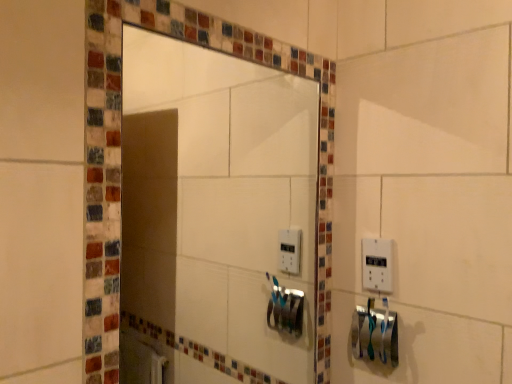
The height and width of the screenshot is (384, 512). In order to click on white plastic light switch at right in this screenshot , I will do `click(377, 265)`.

What do you see at coordinates (377, 265) in the screenshot? The image size is (512, 384). I see `white plastic light switch at right` at bounding box center [377, 265].

The height and width of the screenshot is (384, 512). What do you see at coordinates (218, 205) in the screenshot? I see `matte glass mirror at center` at bounding box center [218, 205].

This screenshot has width=512, height=384. Identify the location of white plastic light switch at right. (377, 265).

Could you measure the distance between silver metallic towel bar at lower right and white plastic light switch at right?

silver metallic towel bar at lower right and white plastic light switch at right are 4.27 inches apart.

Would you say silver metallic towel bar at lower right is outside white plastic light switch at right?

That's correct, silver metallic towel bar at lower right is outside of white plastic light switch at right.

Which of these two, silver metallic towel bar at lower right or white plastic light switch at right, is bigger?

silver metallic towel bar at lower right is bigger.

Is there a large distance between silver metallic towel bar at lower right and white plastic light switch at right?

No.

Which point is more distant from viewer, (353, 317) or (132, 148)?

Point (132, 148)

Based on the photo, which of these two, silver metallic towel bar at lower right or matte glass mirror at center, stands shorter?

Standing shorter between the two is silver metallic towel bar at lower right.

From the image's perspective, is silver metallic towel bar at lower right beneath matte glass mirror at center?

Correct, silver metallic towel bar at lower right appears lower than matte glass mirror at center in the image.

In terms of width, does silver metallic towel bar at lower right look wider or thinner when compared to matte glass mirror at center?

silver metallic towel bar at lower right is wider than matte glass mirror at center.

Is matte glass mirror at center looking in the opposite direction of silver metallic towel bar at lower right?

No.

Who is taller, matte glass mirror at center or silver metallic towel bar at lower right?

With more height is matte glass mirror at center.

Would you say matte glass mirror at center is inside or outside silver metallic towel bar at lower right?

matte glass mirror at center exists outside the volume of silver metallic towel bar at lower right.

Looking at this image, which is closer, [174,53] or [381,346]?

The point [381,346] is closer.

From a real-world perspective, who is located higher, white plastic light switch at right or silver metallic towel bar at lower right?

white plastic light switch at right is physically above.

Is white plastic light switch at right in front of or behind silver metallic towel bar at lower right in the image?

white plastic light switch at right is behind silver metallic towel bar at lower right.

Measure the distance between white plastic light switch at right and silver metallic towel bar at lower right.

The distance of white plastic light switch at right from silver metallic towel bar at lower right is 4.27 inches.

Is white plastic light switch at right situated inside silver metallic towel bar at lower right or outside?

white plastic light switch at right exists outside the volume of silver metallic towel bar at lower right.

Which is behind, point (175, 119) or point (385, 279)?

The point (175, 119) is more distant.

Which is more to the right, matte glass mirror at center or white plastic light switch at right?

From the viewer's perspective, white plastic light switch at right appears more on the right side.

Can you confirm if matte glass mirror at center is smaller than white plastic light switch at right?

No, matte glass mirror at center is not smaller than white plastic light switch at right.

Is matte glass mirror at center not near white plastic light switch at right?

No, matte glass mirror at center is not far from white plastic light switch at right.

Which point is more distant from viewer, (373, 247) or (142, 232)?

Positioned behind is point (142, 232).

Does white plastic light switch at right turn towards matte glass mirror at center?

Yes.

Identify the location of light switch behind the matte glass mirror at center. The width and height of the screenshot is (512, 384). (377, 265).

From a real-world perspective, which is physically above, white plastic light switch at right or matte glass mirror at center?

In real-world perspective, matte glass mirror at center is above.

Find the location of a particular element. This screenshot has width=512, height=384. light switch on the right side of silver metallic towel bar at lower right is located at coordinates (377, 265).

The height and width of the screenshot is (384, 512). Identify the location of mirror above the silver metallic towel bar at lower right (from the image's perspective). (218, 205).

Looking at the image, which one is located closer to matte glass mirror at center, silver metallic towel bar at lower right or white plastic light switch at right?

silver metallic towel bar at lower right.

Which object lies further to the anchor point silver metallic towel bar at lower right, white plastic light switch at right or matte glass mirror at center?

Among the two, matte glass mirror at center is located further to silver metallic towel bar at lower right.

Based on their spatial positions, is matte glass mirror at center or white plastic light switch at right further from silver metallic towel bar at lower right?

Among the two, matte glass mirror at center is located further to silver metallic towel bar at lower right.

From the image, which object appears to be farther from white plastic light switch at right, matte glass mirror at center or silver metallic towel bar at lower right?

Based on the image, matte glass mirror at center appears to be further to white plastic light switch at right.

When comparing their distances from matte glass mirror at center, does white plastic light switch at right or silver metallic towel bar at lower right seem further?

The object further to matte glass mirror at center is white plastic light switch at right.

Which object lies nearer to the anchor point white plastic light switch at right, silver metallic towel bar at lower right or matte glass mirror at center?

silver metallic towel bar at lower right lies closer to white plastic light switch at right than the other object.

At what (x,y) coordinates should I click in order to perform the action: click on towel bar between matte glass mirror at center and white plastic light switch at right from front to back. Please return your answer as a coordinate pair (x, y). Looking at the image, I should click on (375, 333).